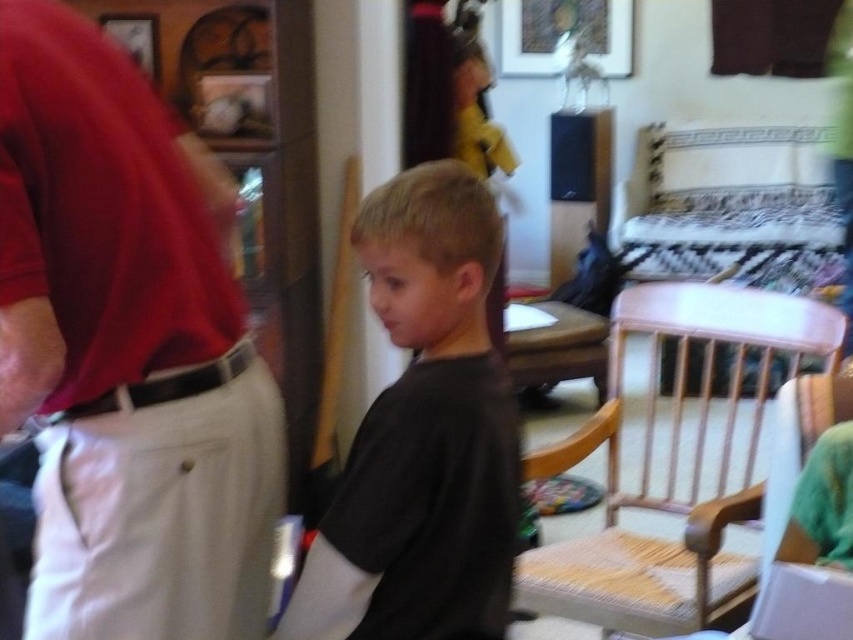
Is point (515, 419) positioned in front of point (592, 580)?

Yes, point (515, 419) is closer to viewer.

The image size is (853, 640). Describe the element at coordinates (422, 435) in the screenshot. I see `black matte shirt at center` at that location.

You are a GUI agent. You are given a task and a screenshot of the screen. Output one action in this format:
    pyautogui.click(x=<x>, y=<y>)
    Task: Click on the black matte shirt at center
    
    Given the screenshot: What is the action you would take?
    pyautogui.click(x=422, y=435)

Is matte red shirt at left closer to camera compared to white woven wood chair at right?

That is True.

Between point (251, 371) and point (640, 326), which one is positioned in front?

Point (251, 371) is in front.

Which is in front, point (20, 129) or point (543, 552)?

Point (20, 129) is in front.

The width and height of the screenshot is (853, 640). In order to click on matte red shirt at left in this screenshot , I will do tap(126, 349).

Is matte red shirt at left shorter than black matte shirt at center?

Incorrect, matte red shirt at left's height does not fall short of black matte shirt at center's.

Who is shorter, matte red shirt at left or black matte shirt at center?

Standing shorter between the two is black matte shirt at center.

The width and height of the screenshot is (853, 640). In order to click on matte red shirt at left in this screenshot , I will do `click(126, 349)`.

Identify the location of matte red shirt at left. (126, 349).